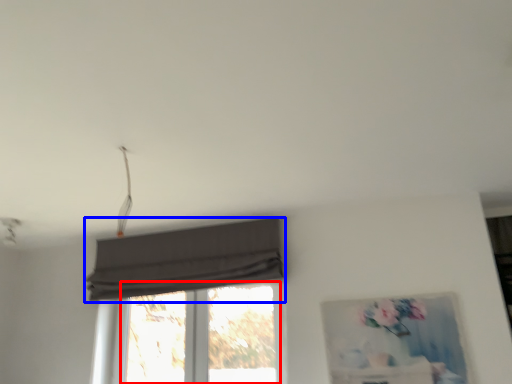
Question: Which object is closer to the camera taking this photo, window (highlighted by a red box) or curtain (highlighted by a blue box)?

Choices:
 (A) window
 (B) curtain

Answer: (B)